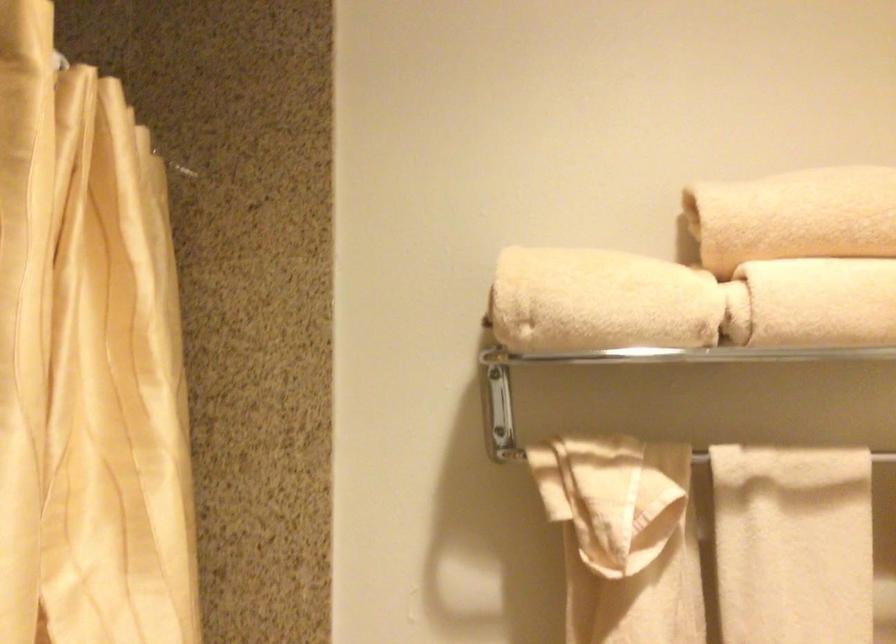
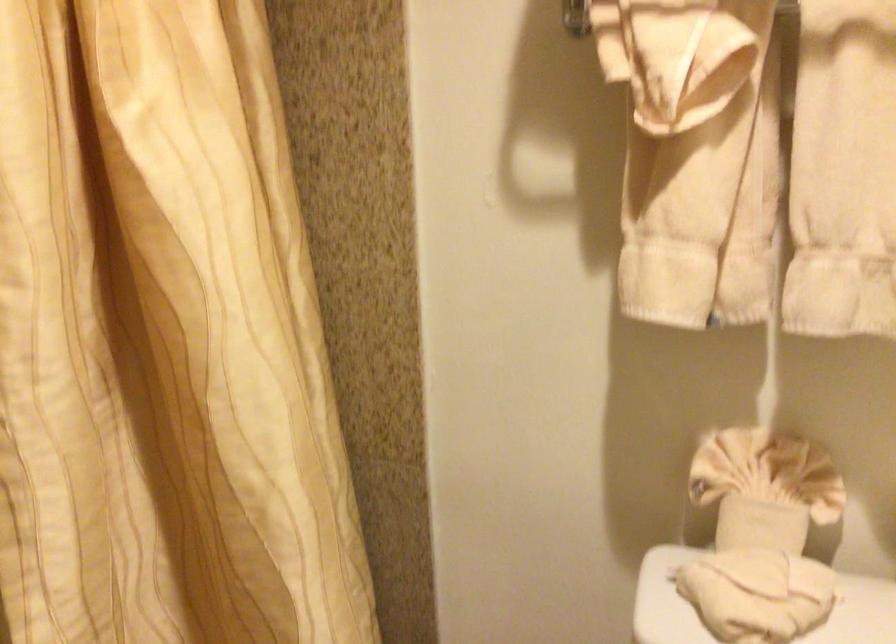
Question: The images are taken continuously from a first-person perspective. In which direction are you moving?

Choices:
 (A) Left
 (B) Right
 (C) Forward
 (D) Backward

Answer: (B)